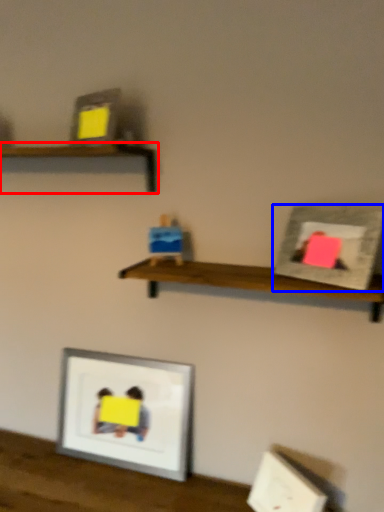
Question: Which object is closer to the camera taking this photo, shelf (highlighted by a red box) or picture frame (highlighted by a blue box)?

Choices:
 (A) shelf
 (B) picture frame

Answer: (B)